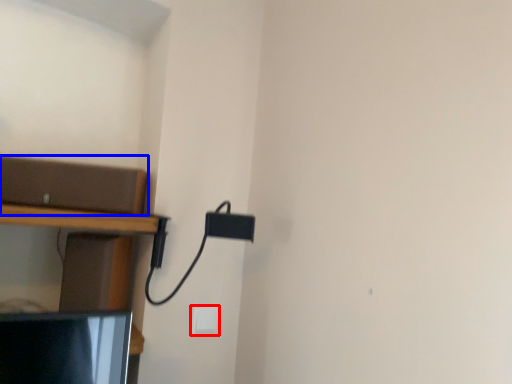
Question: Among these objects, which one is nearest to the camera, light switch (highlighted by a red box) or shelf (highlighted by a blue box)?

Choices:
 (A) light switch
 (B) shelf

Answer: (B)